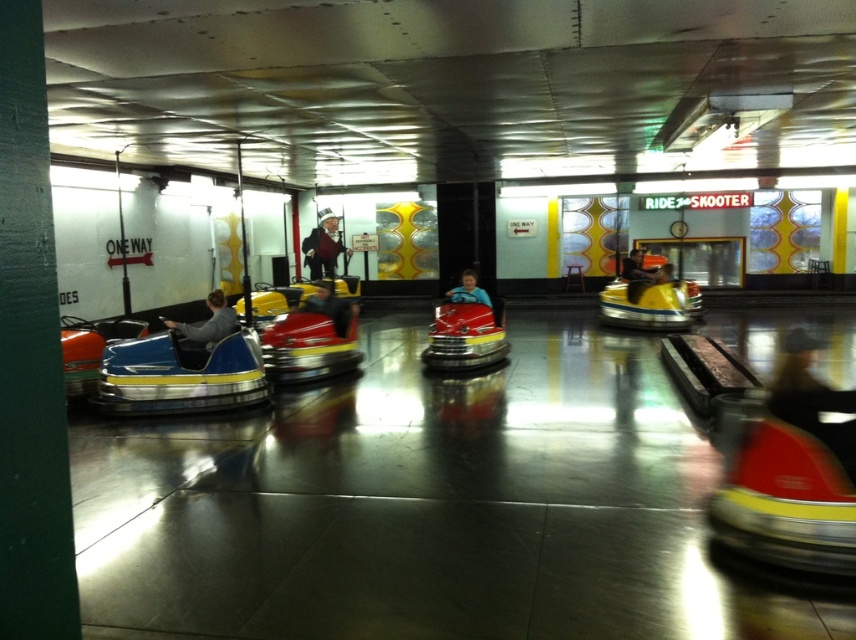
Looking at this image, is smooth black suit at center positioned in front of matte yellow helmet at center?

No, it is behind matte yellow helmet at center.

At what (x,y) coordinates should I click in order to perform the action: click on smooth black suit at center. Please return your answer as a coordinate pair (x, y). This screenshot has height=640, width=856. Looking at the image, I should click on (324, 246).

Image resolution: width=856 pixels, height=640 pixels. What do you see at coordinates (324, 246) in the screenshot?
I see `smooth black suit at center` at bounding box center [324, 246].

In order to click on smooth black suit at center in this screenshot , I will do `click(324, 246)`.

Is point (325, 264) behind point (207, 321)?

Yes, point (325, 264) is farther from viewer.

I want to click on smooth black suit at center, so click(324, 246).

From the picture: Who is more distant from viewer, (x=325, y=266) or (x=455, y=298)?

Point (x=325, y=266)

Is smooth black suit at center thinner than smooth blue helmet at center?

Incorrect, smooth black suit at center's width is not less than smooth blue helmet at center's.

Image resolution: width=856 pixels, height=640 pixels. Describe the element at coordinates (324, 246) in the screenshot. I see `smooth black suit at center` at that location.

This screenshot has height=640, width=856. Identify the location of smooth black suit at center. (324, 246).